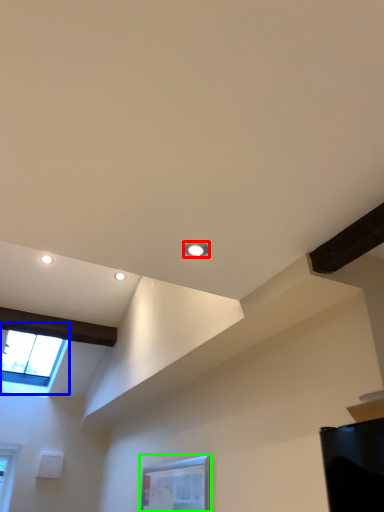
Question: Which object is the closest to the droplight (highlighted by a red box)? Choose among these: window (highlighted by a blue box) or window (highlighted by a green box).

Choices:
 (A) window
 (B) window

Answer: (B)